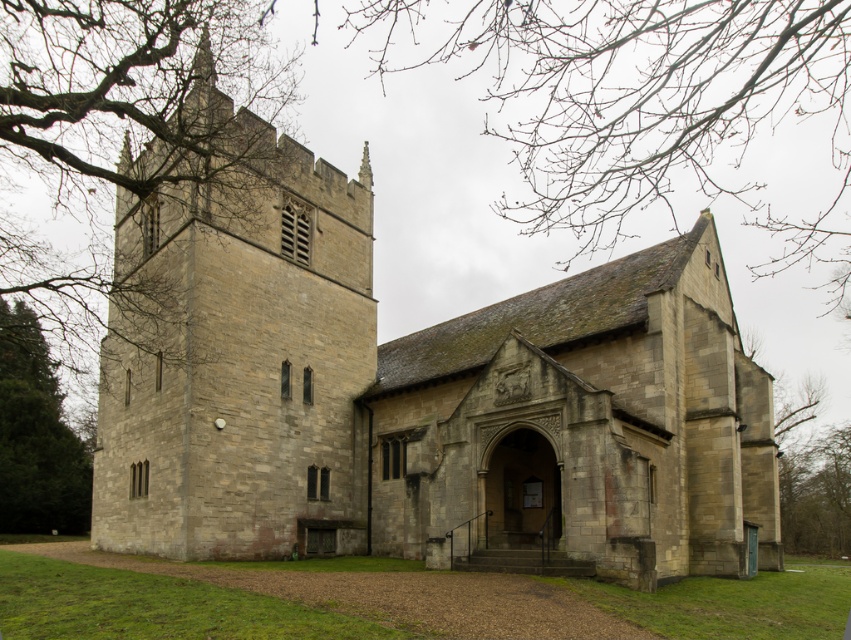
Question: Is bare branches at upper center further to camera compared to green leafy tree at left?

Choices:
 (A) no
 (B) yes

Answer: (A)

Question: Can you confirm if bare branches at upper center is wider than green leafy tree at left?

Choices:
 (A) no
 (B) yes

Answer: (B)

Question: Does bare branches at upper left have a smaller size compared to green leafy tree at left?

Choices:
 (A) yes
 (B) no

Answer: (B)

Question: Which point is farther to the camera?

Choices:
 (A) bare branches at upper left
 (B) stone church at center
 (C) green leafy tree at left

Answer: (C)

Question: Which object is farther from the camera taking this photo?

Choices:
 (A) stone church at center
 (B) green leafy tree at left
 (C) bare branches at upper center

Answer: (B)

Question: Among these objects, which one is farthest from the camera?

Choices:
 (A) bare branches at upper left
 (B) bare branches at upper center
 (C) stone church at center

Answer: (C)